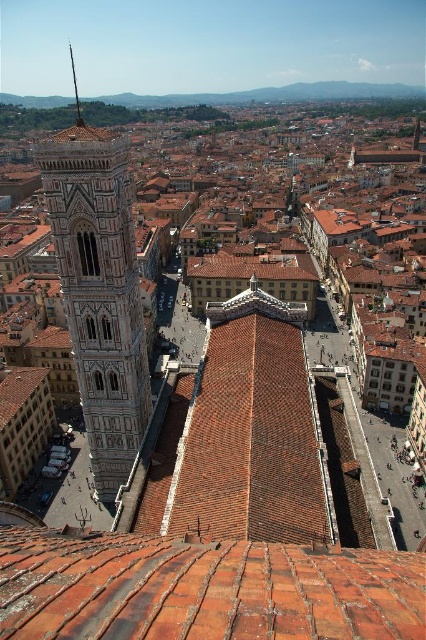
You are standing in the piazza of Florence and see the terracotta tiles at center and the white stone bell tower at left. Which object is closer to the ground?

The terracotta tiles at center are closer to the ground because they are positioned below the white stone bell tower at left.

You are standing in Florence and want to take a photo of the white stone bell tower at left. If you are currently at the center of the image, which direction should you move to frame the tower in your camera?

The white stone bell tower at left is located at point (100, 292), so you should move to your left and slightly downward to frame it properly.

You are an architect visiting Florence and want to compare the sizes of the terracotta tiles at center and the white stone bell tower at left in the image. Based on their positions in the scene, which object appears larger?

The white stone bell tower at left appears larger than the terracotta tiles at center because the description states that the terracotta tiles at center has a smaller size compared to the white stone bell tower at left.